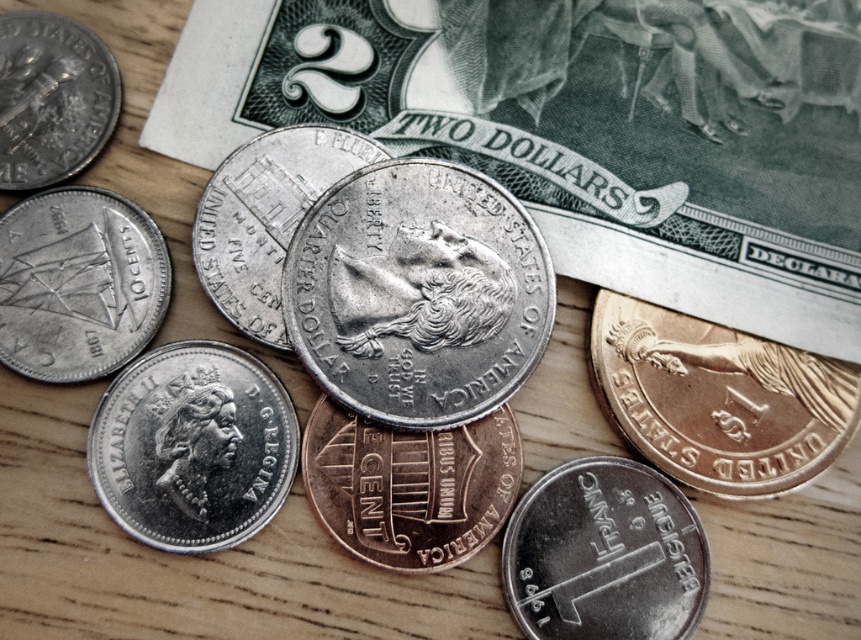
Question: Is copper/brass penny at center bigger than shiny silver coin at upper left?

Choices:
 (A) yes
 (B) no

Answer: (A)

Question: Can you confirm if silver metallic coin at lower left is positioned to the right of copper/brass penny at center?

Choices:
 (A) yes
 (B) no

Answer: (B)

Question: Is gold metallic dollar at right bigger than satin silver quarter at center?

Choices:
 (A) no
 (B) yes

Answer: (B)

Question: Which of the following is the closest to the observer?

Choices:
 (A) (67, 208)
 (B) (327, 182)
 (C) (91, 60)
 (D) (791, 445)

Answer: (A)

Question: Which point appears closest to the camera in this image?

Choices:
 (A) (623, 512)
 (B) (810, 410)
 (C) (451, 432)

Answer: (A)

Question: Which point is farther to the camera?

Choices:
 (A) gold metallic dollar at right
 (B) silver metallic coin at lower left
 (C) shiny silver coin at upper left
 (D) silver/metallic coin at left

Answer: (A)